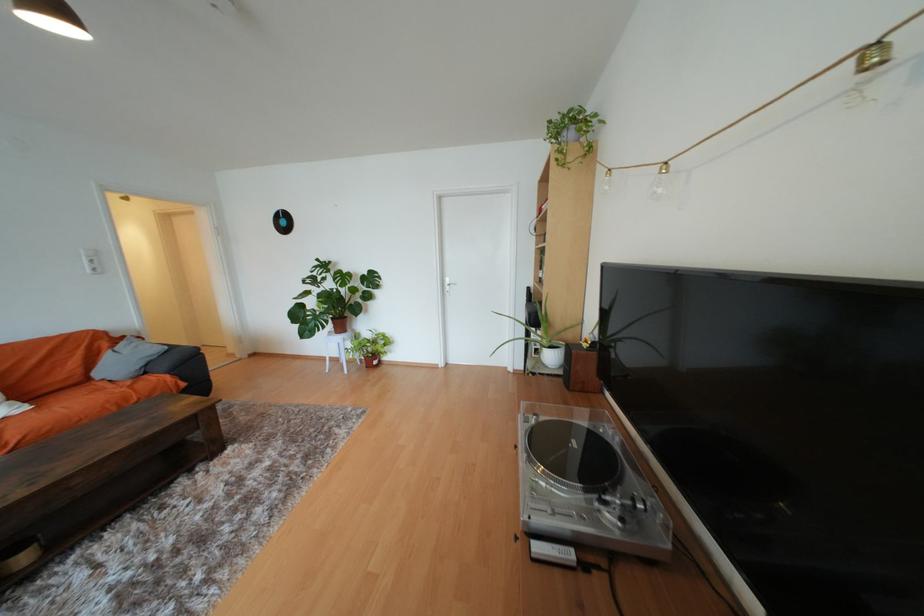
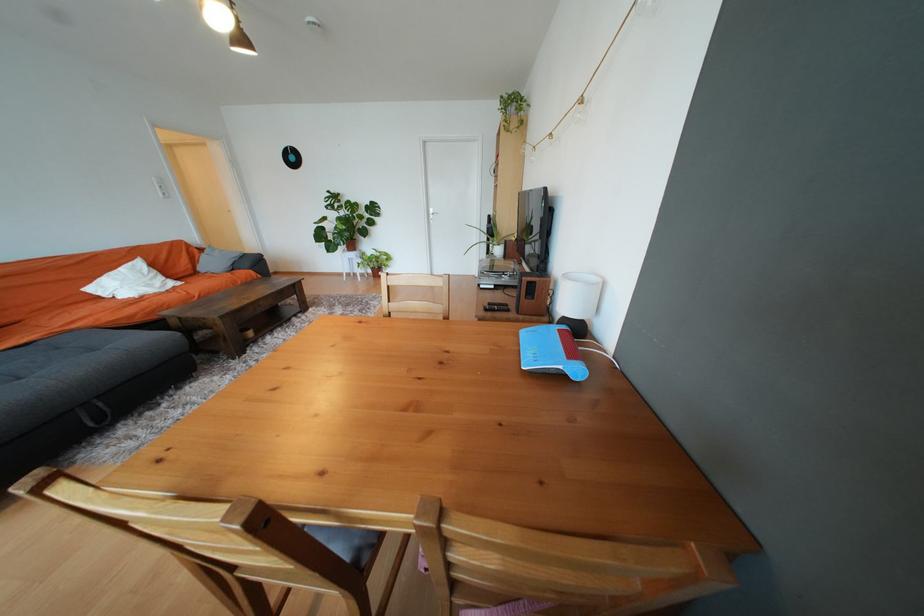
Find the pixel in the second image that matches (341,329) in the first image.

(354, 248)